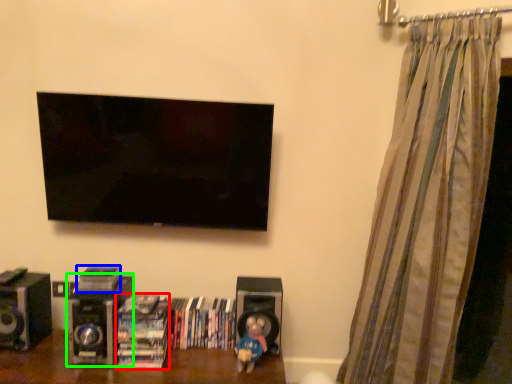
Question: Which object is positioned closest to book (highlighted by a red box)? Select from book (highlighted by a blue box) and speaker (highlighted by a green box).

Choices:
 (A) book
 (B) speaker

Answer: (B)